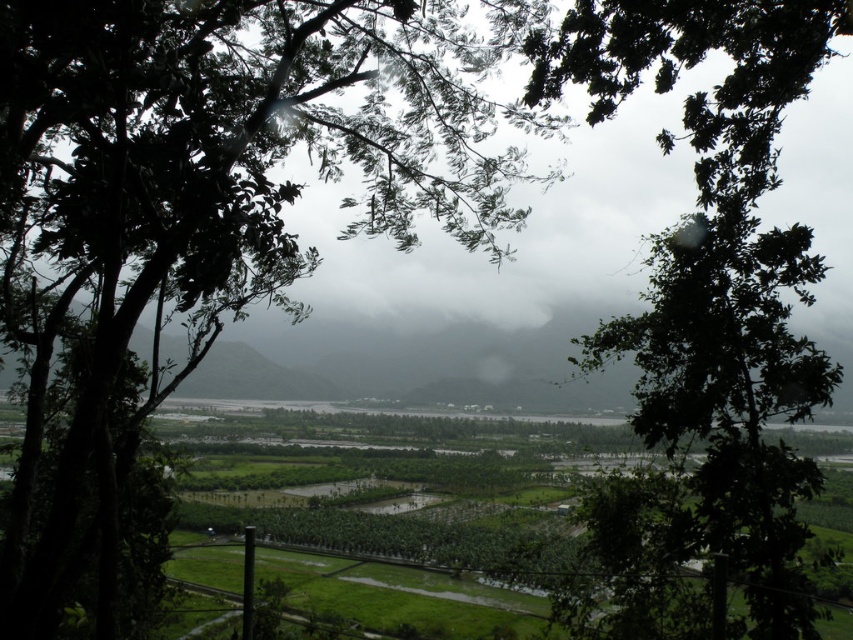
You are an artist trying to paint the scene through the branches of two green leafy trees. Which tree, the green leafy tree at center or the green leafy tree at upper center, will appear closer to you when you look through them?

The green leafy tree at center appears closer because it is bigger than the green leafy tree at upper center, which is smaller and farther away.

You are standing at the base of the tree in the foreground and want to walk straight ahead towards the mountains in the background. Will the green leafy tree at center block your view of the mountains?

The green leafy tree at center is positioned at point (227, 173), which is in the center of the image. Since you are standing at the base of the tree in the foreground, walking straight ahead would mean moving towards the mountains in the background. However, the tree is in the foreground, so it would block your view of the mountains until you move past it. Once you walk around or through the tree branches, you can see the mountains clearly.

You are standing in the rural landscape scene and want to walk from the point at coordinates point (451, 157) to the point at coordinates point (660, 378). Which direction should you move relative to your current position?

You should move away from the camera because point (451, 157) is closer to the camera than point (660, 378). To reach the latter, you need to move further into the scene.